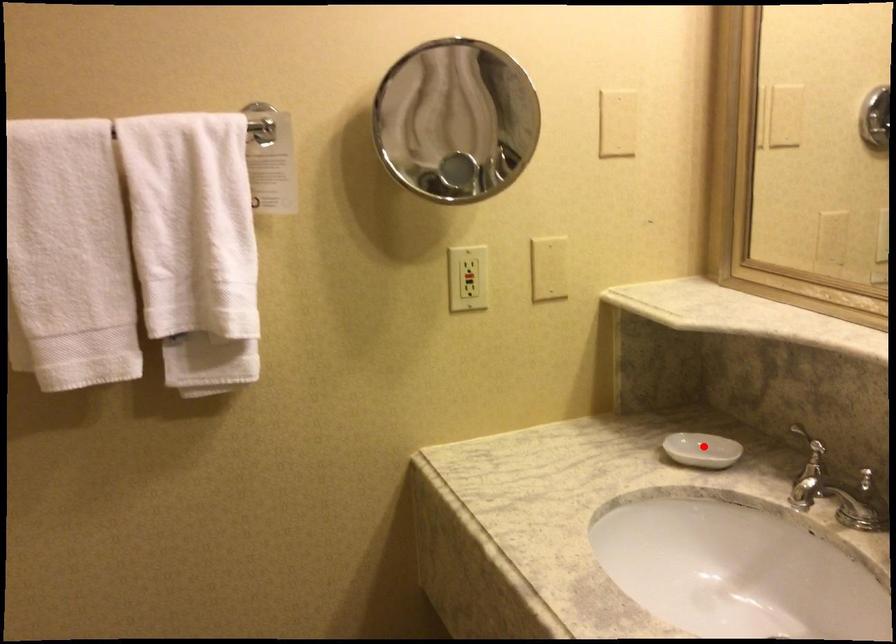
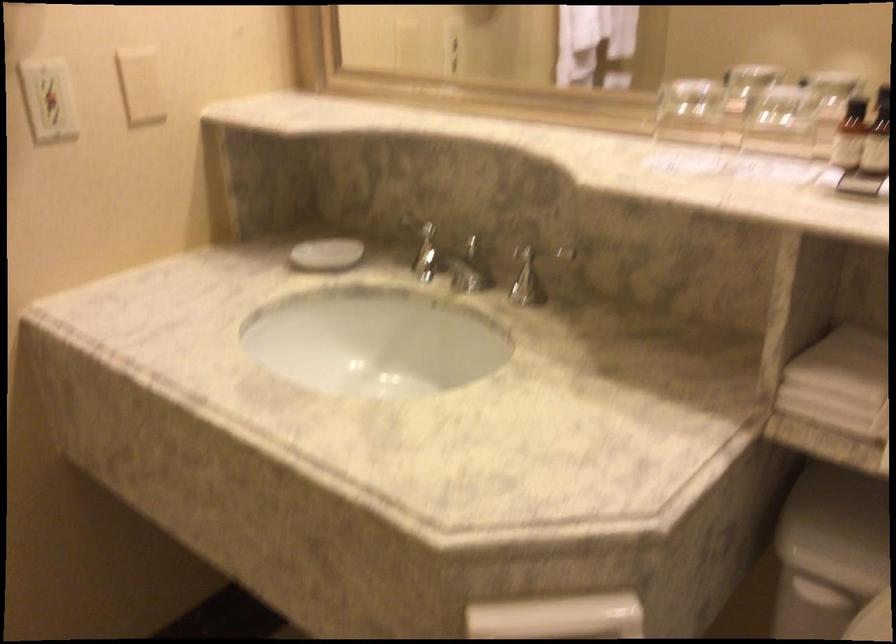
Find the pixel in the second image that matches the highlighted location in the first image.

(325, 254)